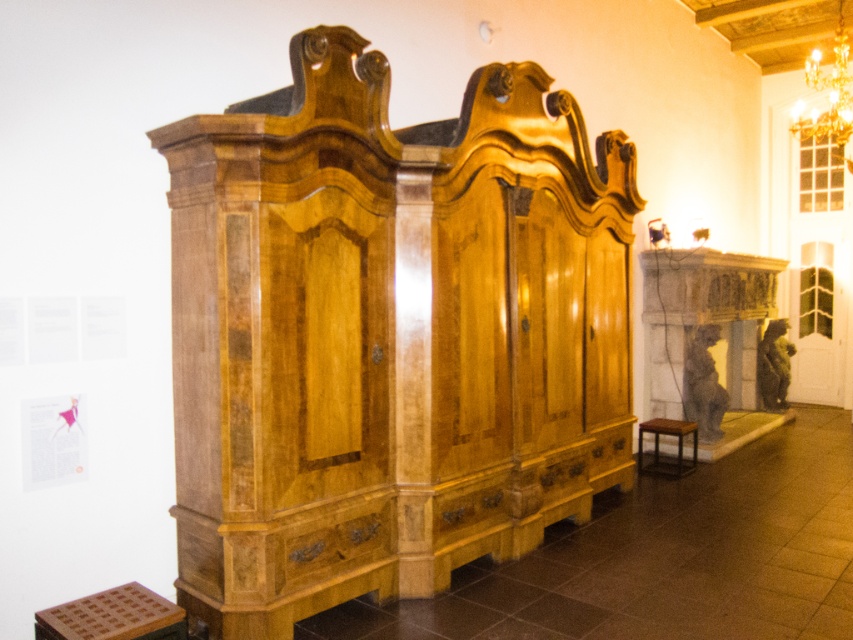
You are a delivery person trying to place a small package on the shiny brown wood drawer at lower center. However, there is a brown wooden stool at lower right nearby. Will the stool block the drawer if you want to place the package on it?

The shiny brown wood drawer at lower center is shorter than the brown wooden stool at lower right. Since the stool is taller, it might block access to the drawer, making it difficult to place the package on the drawer.

You are an interior designer trying to place a new rug in the room. The rug must be placed between the glossy wood dresser at center and the shiny brown wood drawer at lower center. Considering their sizes, which object should the rug be closer to?

The glossy wood dresser at center is larger in size than the shiny brown wood drawer at lower center, so the rug should be closer to the glossy wood dresser at center to accommodate its size.